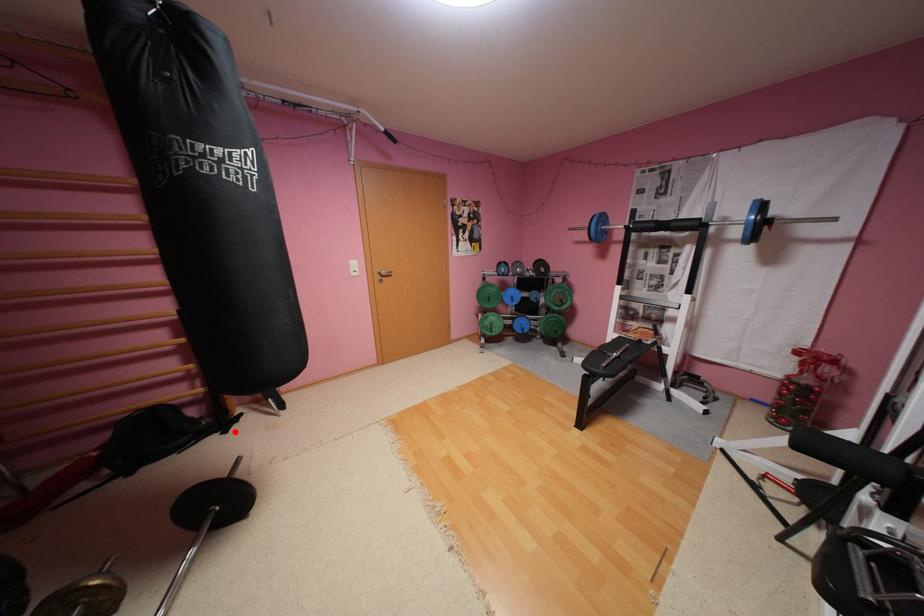
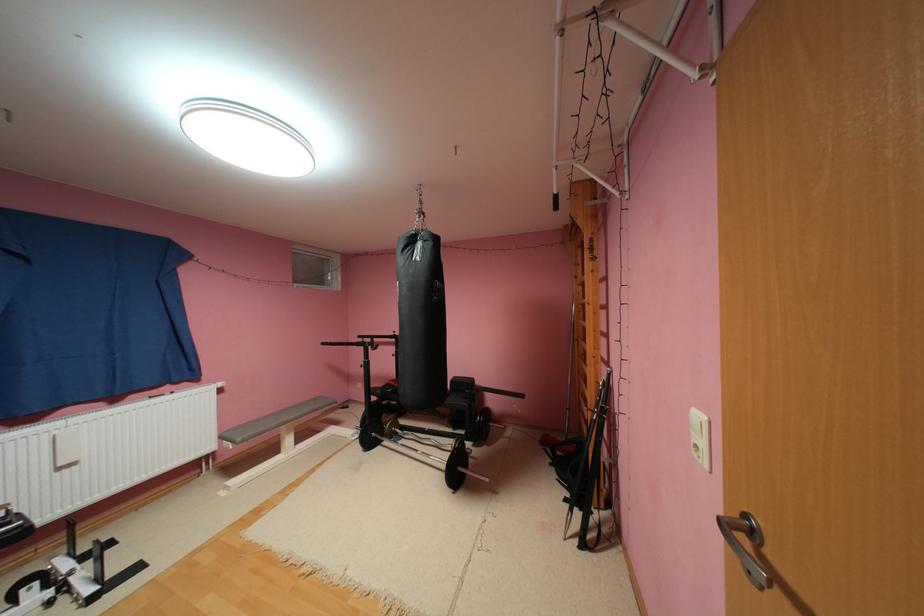
Question: A red point is marked in image1. In image2, is the corresponding 3D point closer to the camera or farther? Reply with the corresponding letter.

Choices:
 (A) The corresponding 3D point is closer.
 (B) The corresponding 3D point is farther.

Answer: (A)